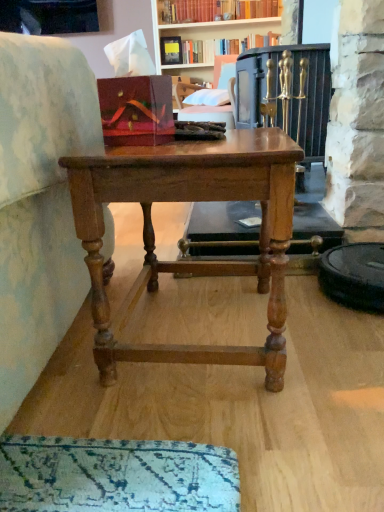
At what (x,y) coordinates should I click in order to perform the action: click on vacant space situated above hardcover book at upper center (from a real-world perspective). Please return your answer as a coordinate pair (x, y). Image resolution: width=384 pixels, height=512 pixels. Looking at the image, I should click on (228, 33).